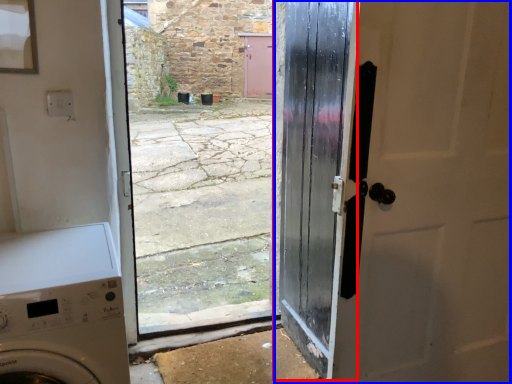
Question: Which object appears farthest to the camera in this image, door (highlighted by a red box) or door (highlighted by a blue box)?

Choices:
 (A) door
 (B) door

Answer: (A)